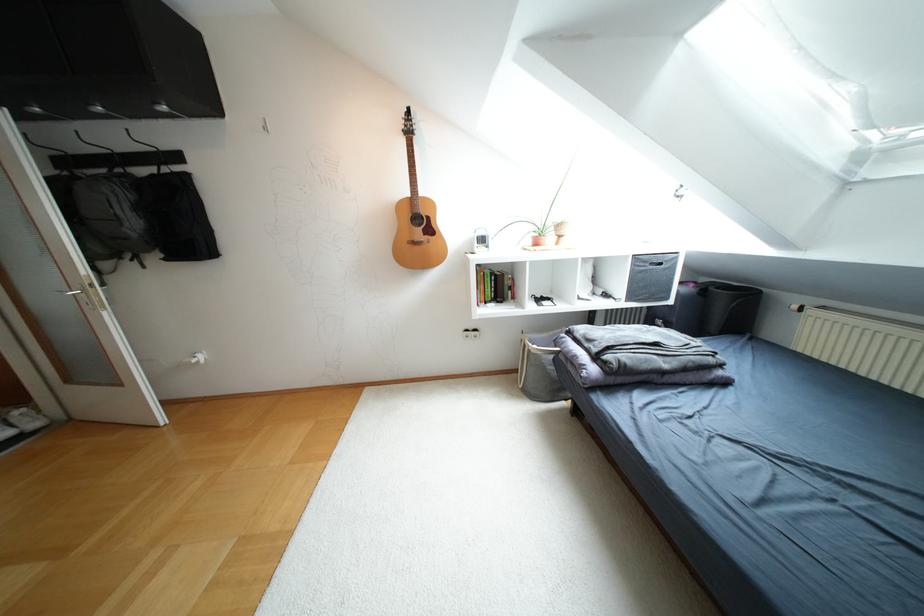
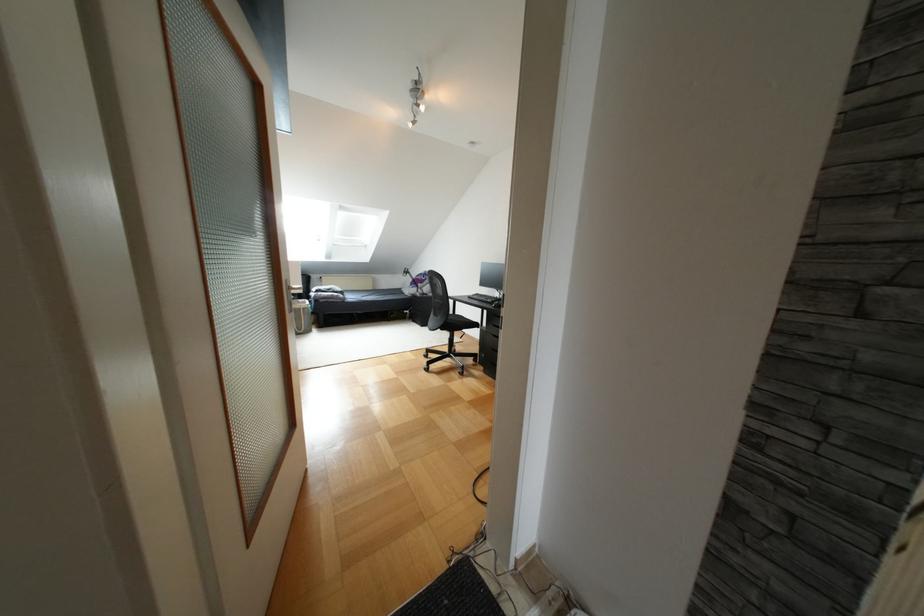
Question: I am providing you with two images of the same scene from different viewpoints. After the viewpoint changes to image2, which objects are now occluded?

Choices:
 (A) sofa sitting surface
 (B) gold computer mouse
 (C) potted plant
 (D) black keyboard

Answer: (C)